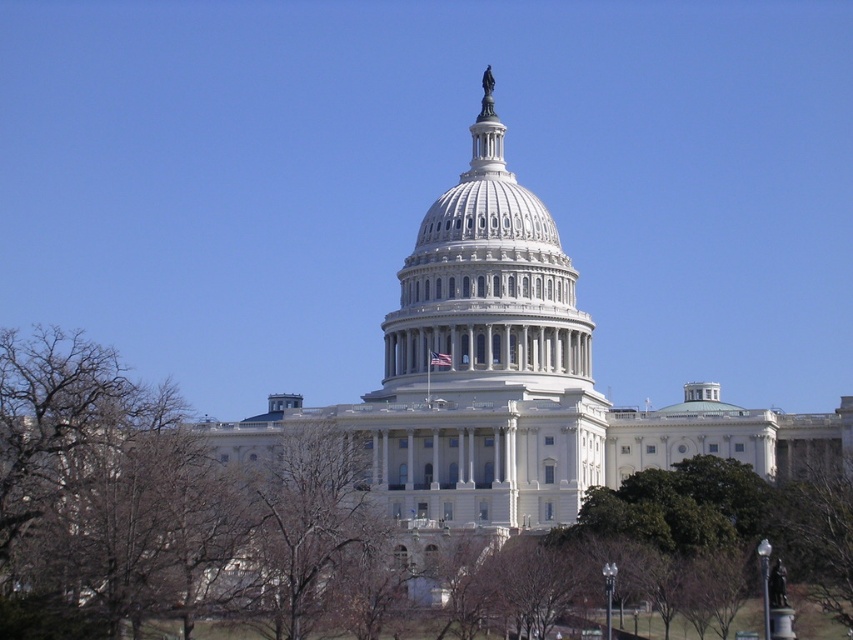
Question: Based on their relative distances, which object is farther from the bare branches at center?

Choices:
 (A) white marble dome at center
 (B) brown leafless tree at lower left

Answer: (A)

Question: From the image, what is the correct spatial relationship of brown leafless tree at lower left in relation to bare branches at center?

Choices:
 (A) left
 (B) right

Answer: (A)

Question: Which of these objects is positioned farthest from the white marble dome at center?

Choices:
 (A) brown leafless tree at lower left
 (B) bare branches at center

Answer: (B)

Question: Does brown leafless tree at lower left appear on the right side of white marble dome at center?

Choices:
 (A) yes
 (B) no

Answer: (B)

Question: Which point appears closest to the camera in this image?

Choices:
 (A) click(265, 570)
 (B) click(126, 544)

Answer: (B)

Question: Does brown leafless tree at lower left appear under bare branches at center?

Choices:
 (A) yes
 (B) no

Answer: (B)